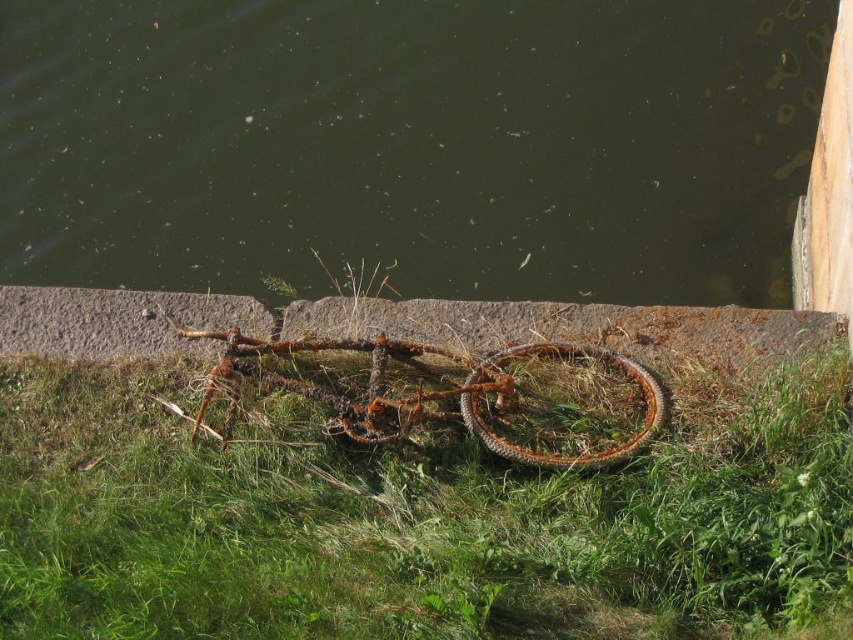
Does green murky water at center have a larger size compared to green grass at center?

Correct, green murky water at center is larger in size than green grass at center.

Is green murky water at center positioned in front of green grass at center?

That is False.

The image size is (853, 640). What do you see at coordinates (410, 144) in the screenshot?
I see `green murky water at center` at bounding box center [410, 144].

I want to click on green murky water at center, so click(x=410, y=144).

Looking at this image, does green grass at center appear on the right side of rusty metal bicycle at center?

Incorrect, green grass at center is not on the right side of rusty metal bicycle at center.

The width and height of the screenshot is (853, 640). Find the location of `green grass at center`. green grass at center is located at coordinates (412, 520).

The width and height of the screenshot is (853, 640). What are the coordinates of `green grass at center` in the screenshot? It's located at (412, 520).

Where is `green grass at center`? The image size is (853, 640). green grass at center is located at coordinates (412, 520).

Does green murky water at center have a smaller size compared to rusty metal bicycle at center?

Actually, green murky water at center might be larger than rusty metal bicycle at center.

Does green murky water at center have a lesser width compared to rusty metal bicycle at center?

No.

The width and height of the screenshot is (853, 640). What do you see at coordinates (410, 144) in the screenshot?
I see `green murky water at center` at bounding box center [410, 144].

Find the location of `green murky water at center`. green murky water at center is located at coordinates (410, 144).